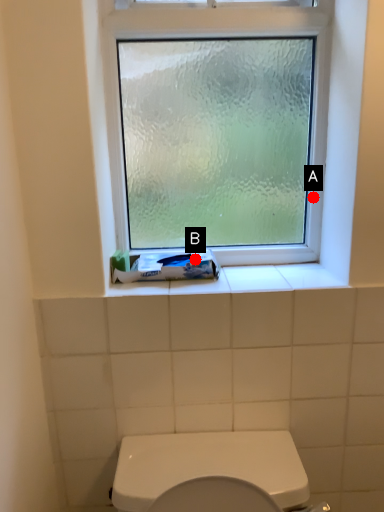
Question: Two points are circled on the image, labeled by A and B beside each circle. Which point is closer to the camera taking this photo?

Choices:
 (A) A is closer
 (B) B is closer

Answer: (B)